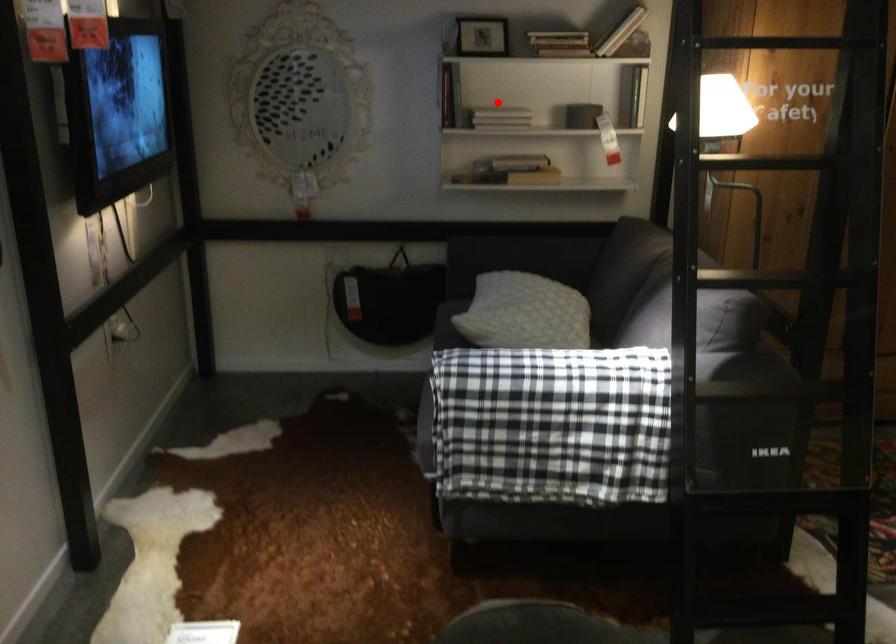
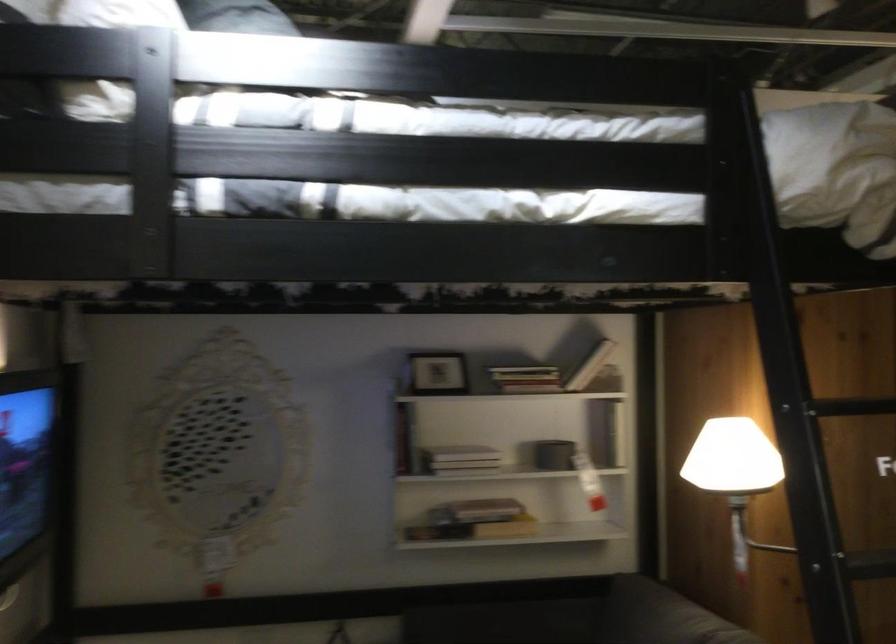
Where in the second image is the point corresponding to the highlighted location from the first image?

(460, 453)